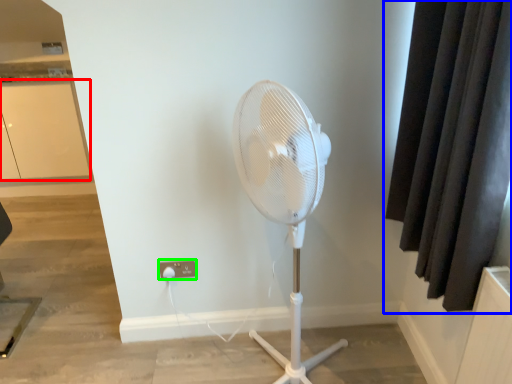
Question: Which is nearer to the screen door (highlighted by a red box)? curtain (highlighted by a blue box) or electric outlet (highlighted by a green box).

Choices:
 (A) curtain
 (B) electric outlet

Answer: (B)